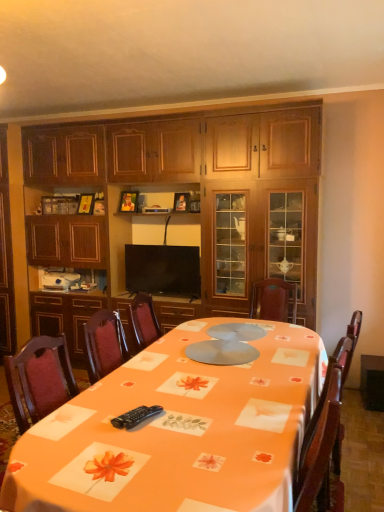
The width and height of the screenshot is (384, 512). In order to click on vacant area on the back side of black plastic remote control at lower center in this screenshot , I will do `click(148, 398)`.